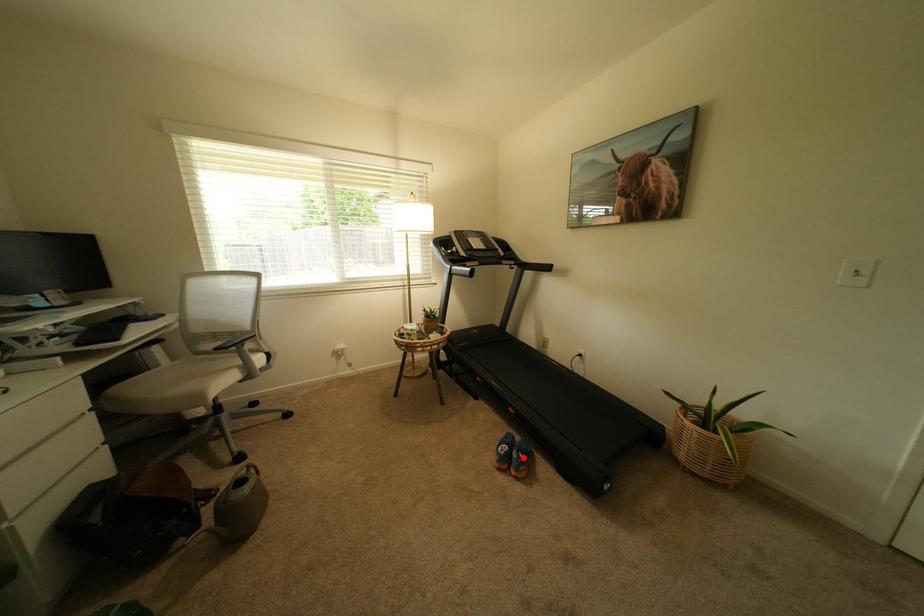
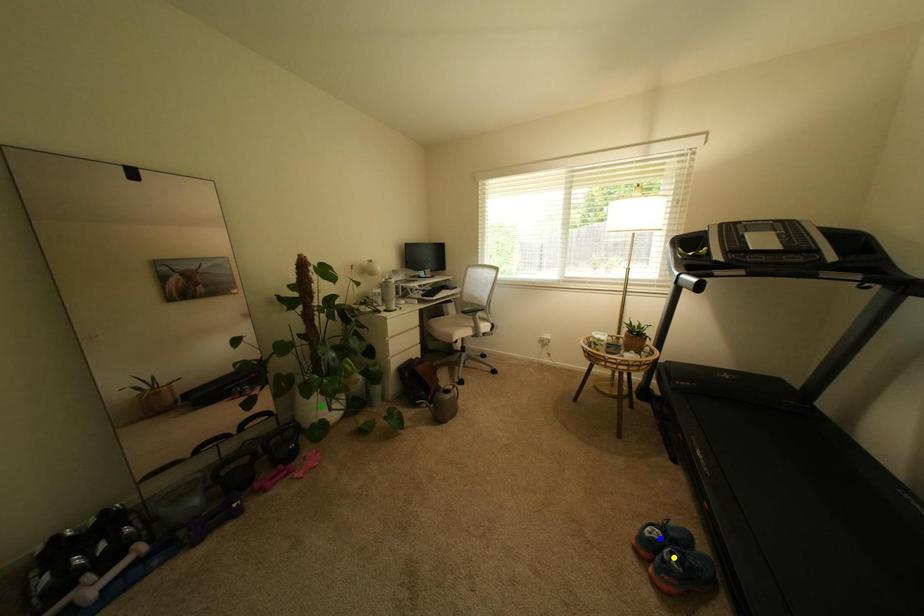
Question: I am providing you with two images of the same scene from different viewpoints. A red point is marked on the first image. You are given multiple points on the second image. Which point in image 2 is actually the same real-world point as the red point in image 1?

Choices:
 (A) yellow point
 (B) blue point
 (C) green point

Answer: (A)